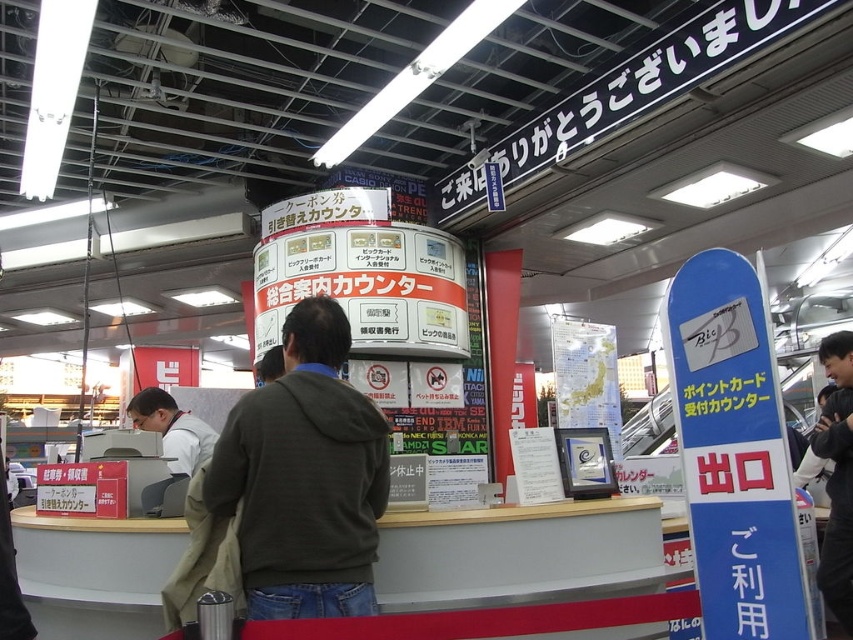
Between dark gray hoodie at center and white shirt at center, which one has more height?

With more height is dark gray hoodie at center.

Between point (247, 460) and point (169, 419), which one is positioned in front?

Point (247, 460)

Find the location of `dark gray hoodie at center`. dark gray hoodie at center is located at coordinates (305, 477).